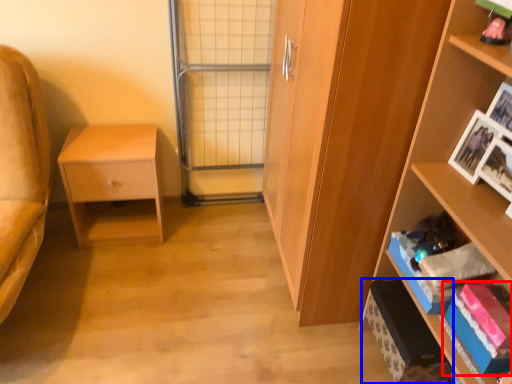
Question: Which object is further to the camera taking this photo, book (highlighted by a red box) or cabinet (highlighted by a blue box)?

Choices:
 (A) book
 (B) cabinet

Answer: (B)